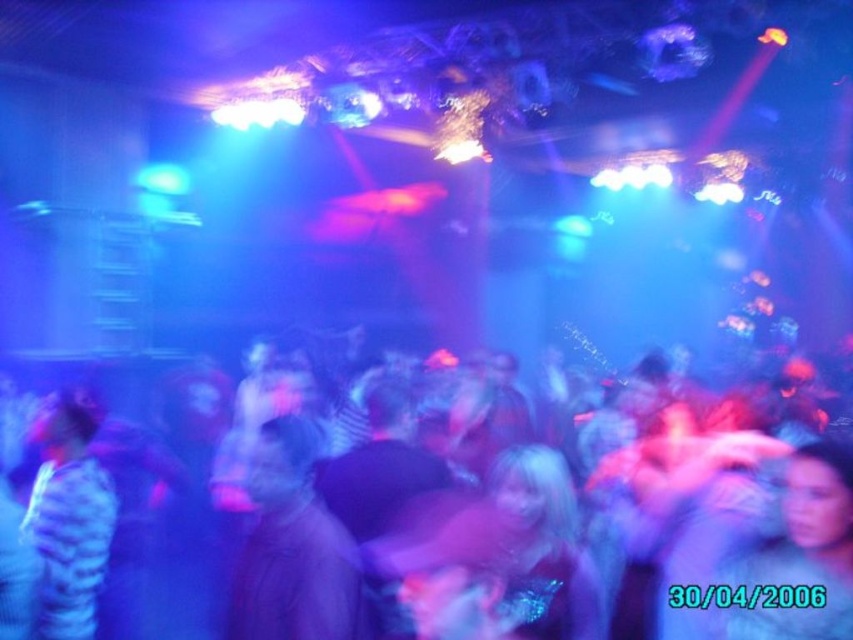
Who is positioned more to the left, blurred people at center or striped fabric shirt at left?

Positioned to the left is striped fabric shirt at left.

Who is higher up, blurred people at center or striped fabric shirt at left?

striped fabric shirt at left is above.

Image resolution: width=853 pixels, height=640 pixels. What are the coordinates of `blurred people at center` in the screenshot? It's located at (299, 579).